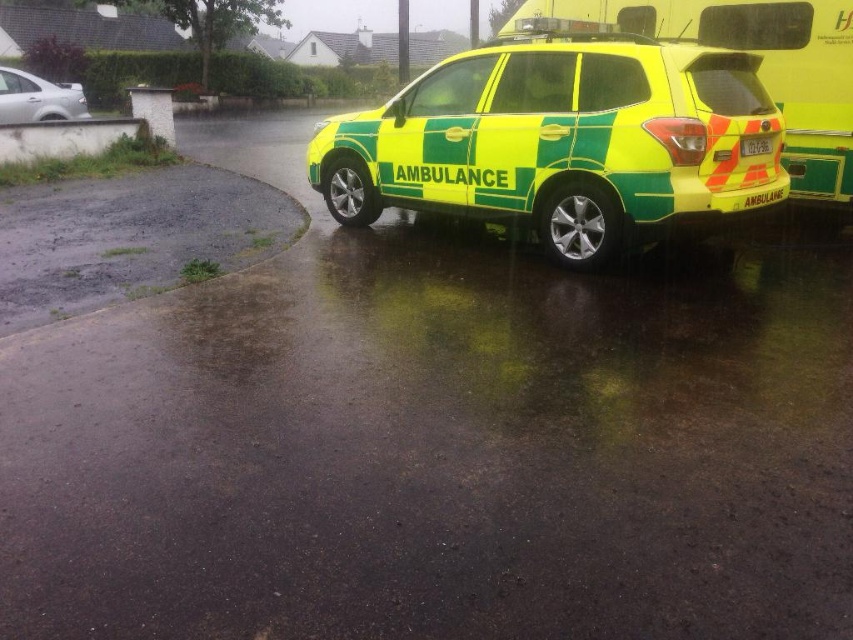
Can you confirm if high-visibility plastic ambulance at center is smaller than satin silver sedan at upper left?

No.

Can you confirm if high-visibility plastic ambulance at center is positioned below satin silver sedan at upper left?

Correct, high-visibility plastic ambulance at center is located below satin silver sedan at upper left.

Locate an element on the screen. high-visibility plastic ambulance at center is located at coordinates coord(561,138).

Where is `high-visibility plastic ambulance at center`? This screenshot has width=853, height=640. high-visibility plastic ambulance at center is located at coordinates (561, 138).